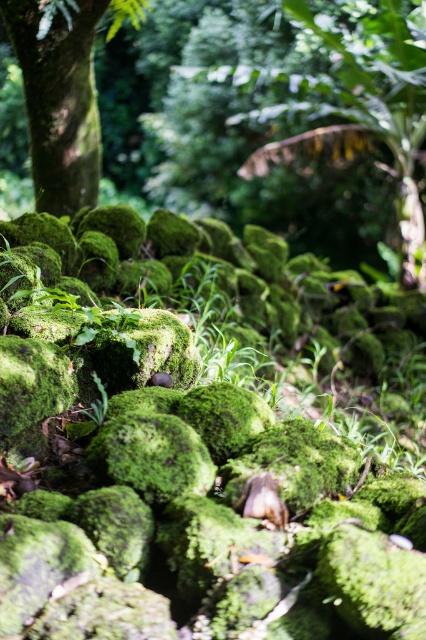
Identify the location of green mossy rock at center. The height and width of the screenshot is (640, 426). (350, 100).

Between green mossy rock at center and green mossy tree trunk at left, which one appears on the left side from the viewer's perspective?

green mossy tree trunk at left is more to the left.

Identify the location of green mossy rock at center. The image size is (426, 640). (350, 100).